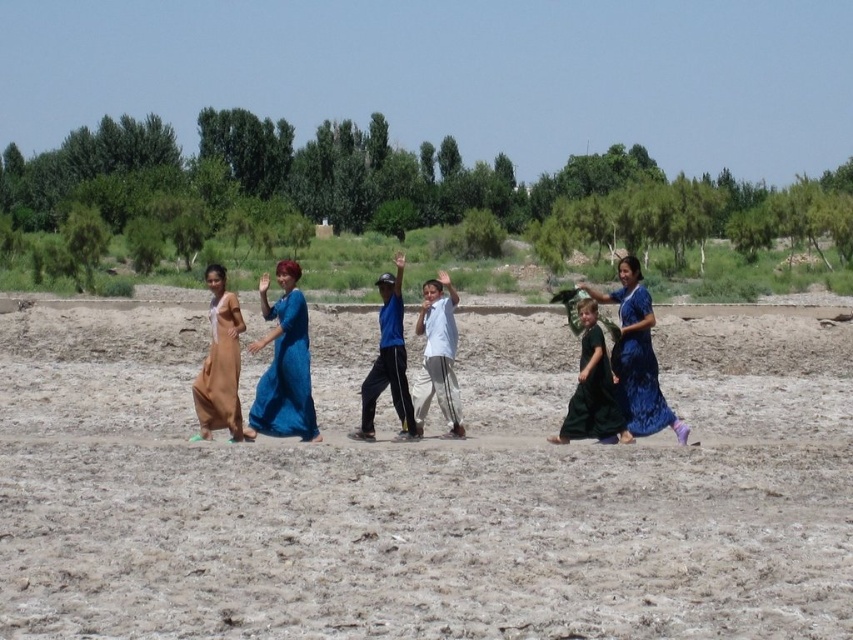
Question: Is matte brown dress at left closer to camera compared to blue satin dress at right?

Choices:
 (A) no
 (B) yes

Answer: (B)

Question: Which point is closer to the camera?

Choices:
 (A) blue textured dress at center
 (B) dark green dress at center
 (C) brown sandy ground at center
 (D) white cotton shirt at center

Answer: (C)

Question: Which point is closer to the camera taking this photo?

Choices:
 (A) (643, 404)
 (B) (598, 392)

Answer: (B)

Question: Does matte blue dress at center appear on the right side of blue fabric pants at center?

Choices:
 (A) yes
 (B) no

Answer: (B)

Question: Can you confirm if blue satin dress at right is positioned below white cotton shirt at center?

Choices:
 (A) no
 (B) yes

Answer: (A)

Question: Which point is farther to the camera?

Choices:
 (A) blue textured dress at center
 (B) blue satin dress at right
 (C) matte blue dress at center
 (D) matte brown dress at left

Answer: (B)